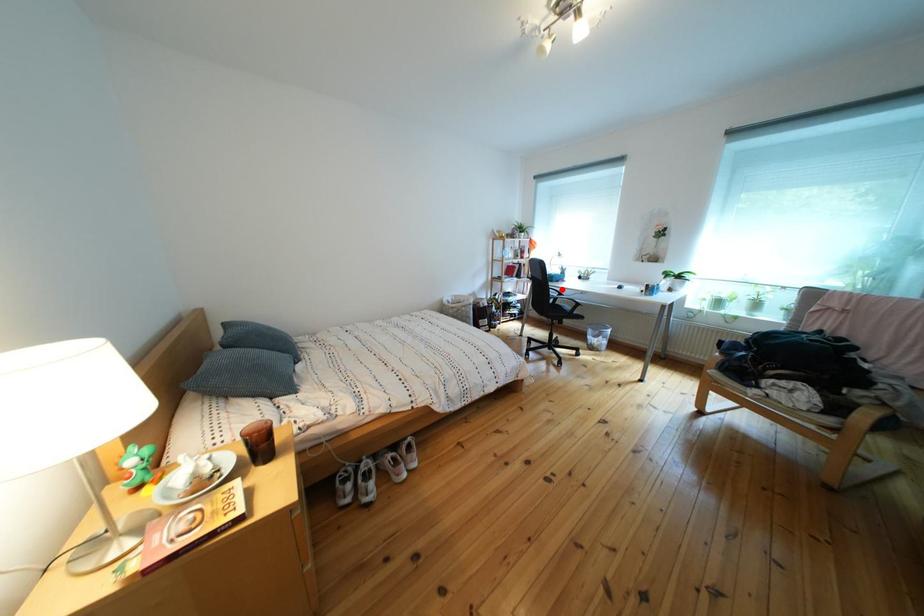
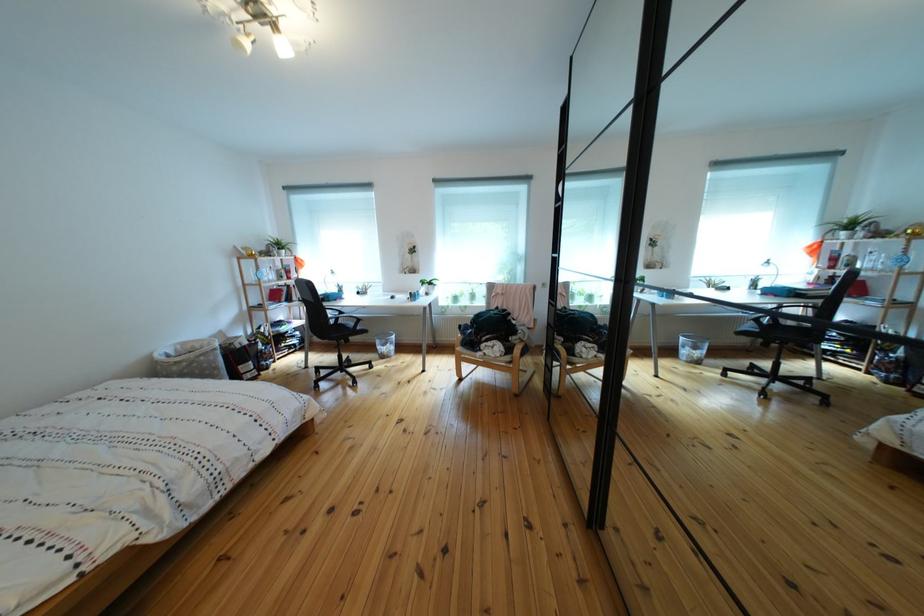
The point at the highlighted location is marked in the first image. Where is the corresponding point in the second image?

(336, 310)